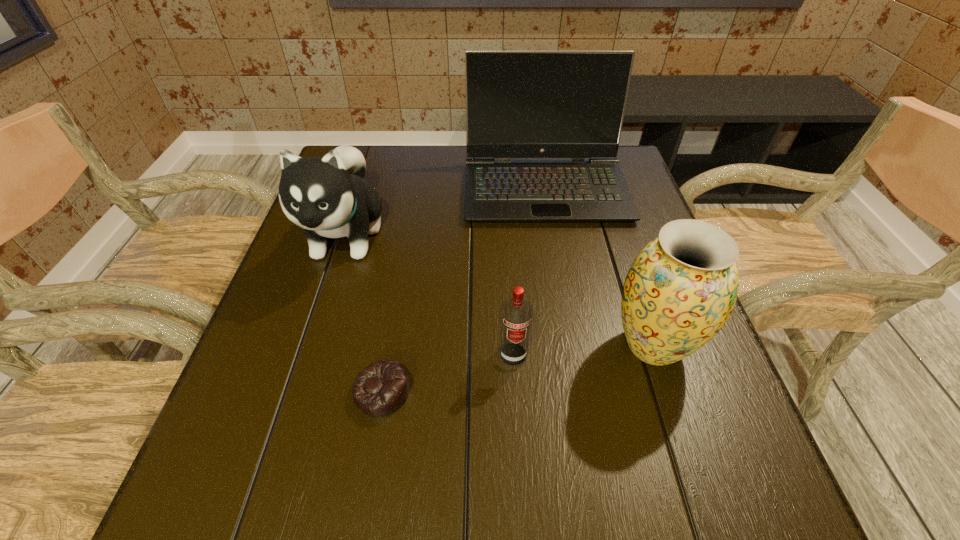
Find the location of `object that is the second closest one to the vase`. object that is the second closest one to the vase is located at coordinates (519, 104).

Where is `object that ranks as the fourth closest to the second object from left to right`? object that ranks as the fourth closest to the second object from left to right is located at coordinates (519, 104).

Locate an element on the screen. The image size is (960, 540). free point that satisfies the following two spatial constraints: 1. on the screen of the vase; 2. on the left side of the laptop computer is located at coordinates (573, 346).

Where is `vacant space that satisfies the following two spatial constraints: 1. at the face of the puppy; 2. on the left side of the vase`? vacant space that satisfies the following two spatial constraints: 1. at the face of the puppy; 2. on the left side of the vase is located at coordinates (310, 346).